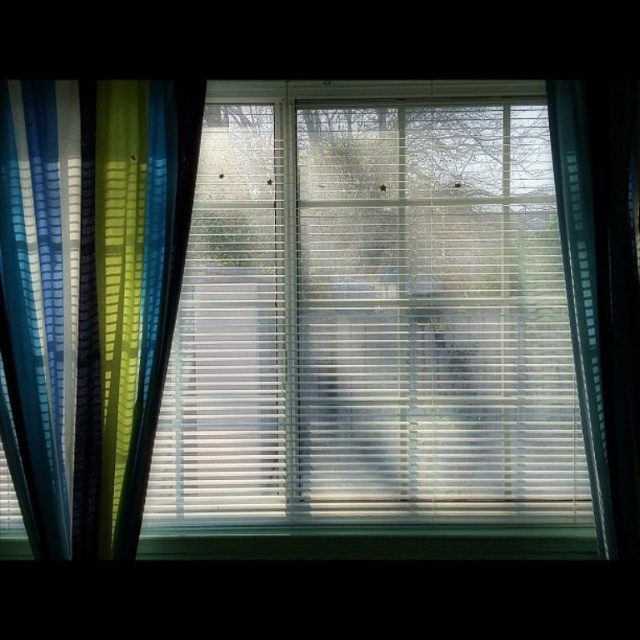
Question: Does translucent plastic blinds at center lie behind blue striped curtain at left?

Choices:
 (A) no
 (B) yes

Answer: (B)

Question: Is translucent plastic blinds at center bigger than blue striped curtain at left?

Choices:
 (A) no
 (B) yes

Answer: (B)

Question: Is translucent plastic blinds at center below blue striped curtain at left?

Choices:
 (A) yes
 (B) no

Answer: (A)

Question: Among these objects, which one is farthest from the camera?

Choices:
 (A) translucent plastic blinds at center
 (B) blue striped curtain at left

Answer: (A)

Question: Which point is closer to the camera?

Choices:
 (A) (516, 131)
 (B) (61, 404)

Answer: (B)

Question: Which point is farther to the camera?

Choices:
 (A) (452, 218)
 (B) (124, 170)

Answer: (A)